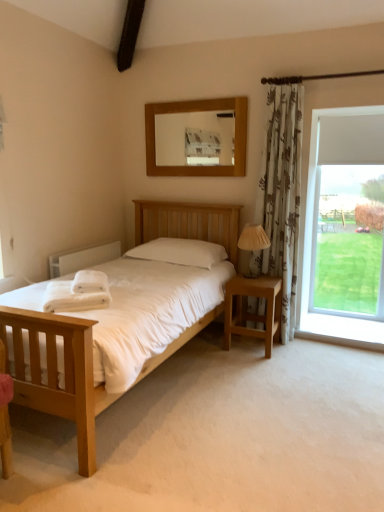
Where is `free space above wooden mirror at upper center (from a real-world perspective)`? free space above wooden mirror at upper center (from a real-world perspective) is located at coordinates (203, 94).